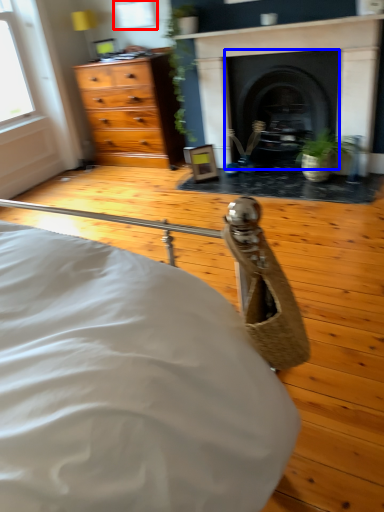
Question: Which point is further to the camera, window (highlighted by a red box) or fireplace (highlighted by a blue box)?

Choices:
 (A) window
 (B) fireplace

Answer: (A)